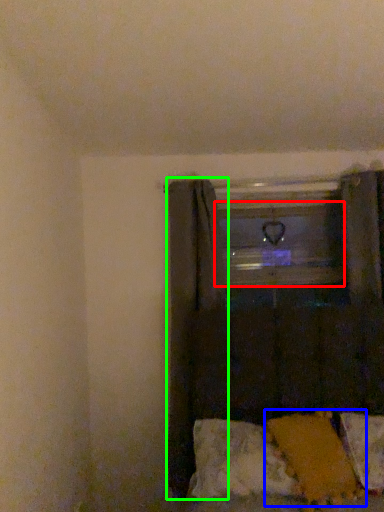
Question: Which object is the farthest from window frame (highlighted by a red box)? Choose among these: pillow (highlighted by a blue box) or curtain (highlighted by a green box).

Choices:
 (A) pillow
 (B) curtain

Answer: (A)